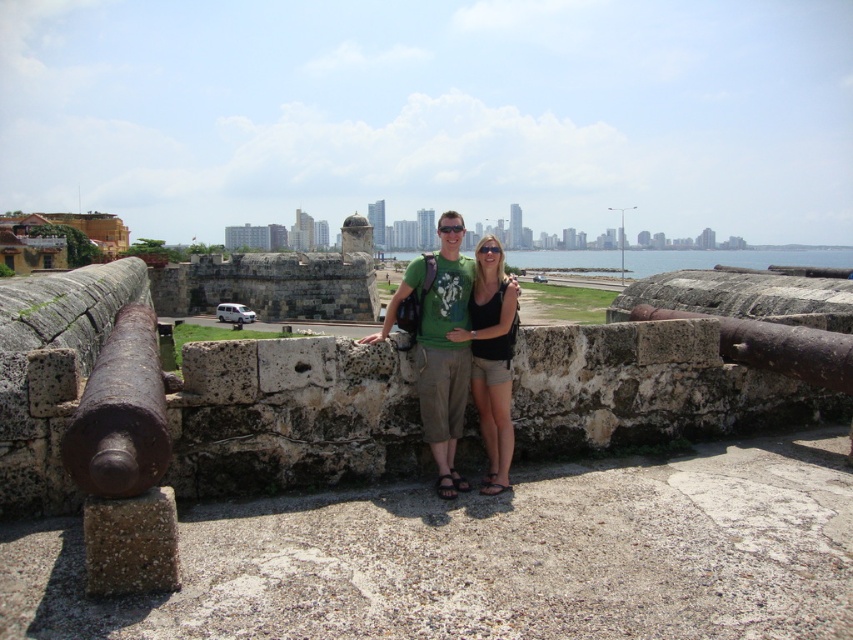
Does green matte t-shirt at center come behind black fabric shorts at center?

Yes.

Is green matte t-shirt at center wider than black fabric shorts at center?

Correct, the width of green matte t-shirt at center exceeds that of black fabric shorts at center.

Is point (448, 364) positioned after point (491, 339)?

No.

Locate an element on the screen. green matte t-shirt at center is located at coordinates (444, 342).

Based on the photo, which of these two, rusty metal cannon at left or blue water at center, stands shorter?

Standing shorter between the two is rusty metal cannon at left.

Who is higher up, rusty metal cannon at left or blue water at center?

blue water at center is above.

Does point (142, 433) lie in front of point (851, 250)?

That is True.

Locate an element on the screen. rusty metal cannon at left is located at coordinates (120, 413).

Find the location of a particular element. rusty metal cannon at left is located at coordinates (120, 413).

Based on the photo, between rusty metal cannon at left and black fabric shorts at center, which one is positioned higher?

black fabric shorts at center is higher up.

Which is behind, point (86, 432) or point (502, 458)?

Positioned behind is point (502, 458).

You are a GUI agent. You are given a task and a screenshot of the screen. Output one action in this format:
    pyautogui.click(x=<x>, y=<y>)
    Task: Click on the rusty metal cannon at left
    This screenshot has width=853, height=640.
    Given the screenshot: What is the action you would take?
    pyautogui.click(x=120, y=413)